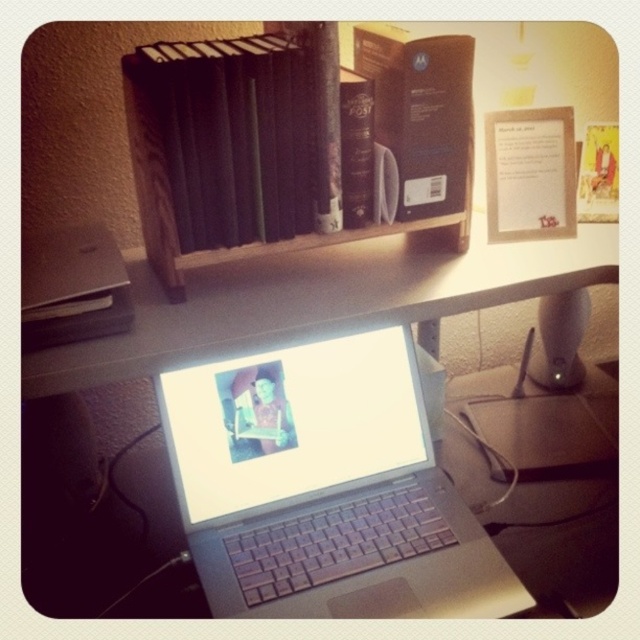
You are a delivery person who needs to place a new package between the satin silver laptop at center and the wooden bookshelf at upper center. The package is 10 inches long. Can you fit it between them without moving either object?

The distance between the satin silver laptop at center and the wooden bookshelf at upper center is 9.70 inches. Since the package is 10 inches long, it cannot fit between them without moving either object.

You are standing in the workspace and want to place a new book on the wooden bookshelf at upper center. According to the image, where exactly should you place the book?

The wooden bookshelf at upper center is located at the coordinates point (294, 141), so you should place the new book at that position.

You are a delivery person entering the workspace and need to place a package on the desk. The package must be placed closer to the viewer than the silver metallic laptop at center. Is the existing package on the shelf near the satin silver laptop at center positioned correctly?

The satin silver laptop at center is further to the viewer than the silver metallic laptop at center. The existing package on the shelf near the satin silver laptop at center is positioned closer to the viewer than the silver metallic laptop at center, so it is correctly placed.